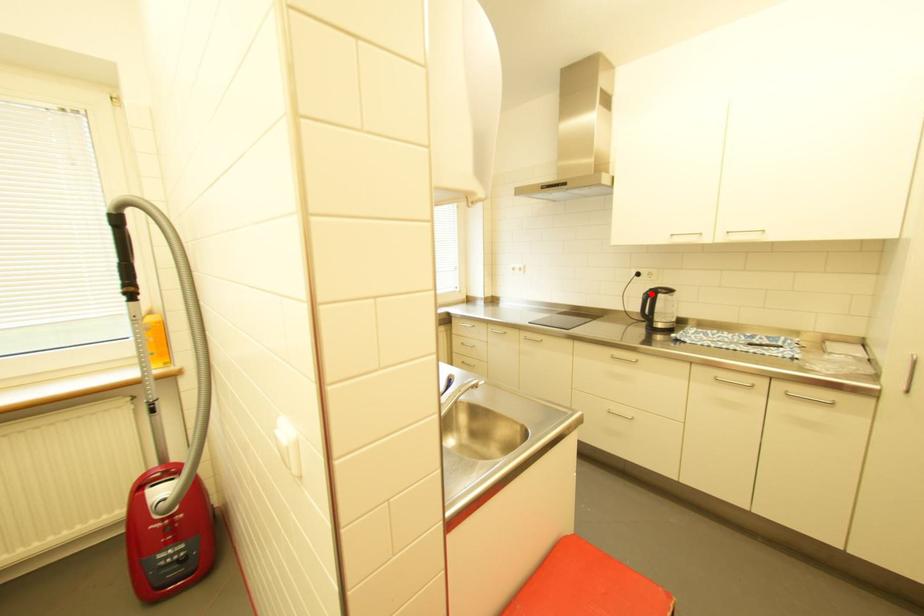
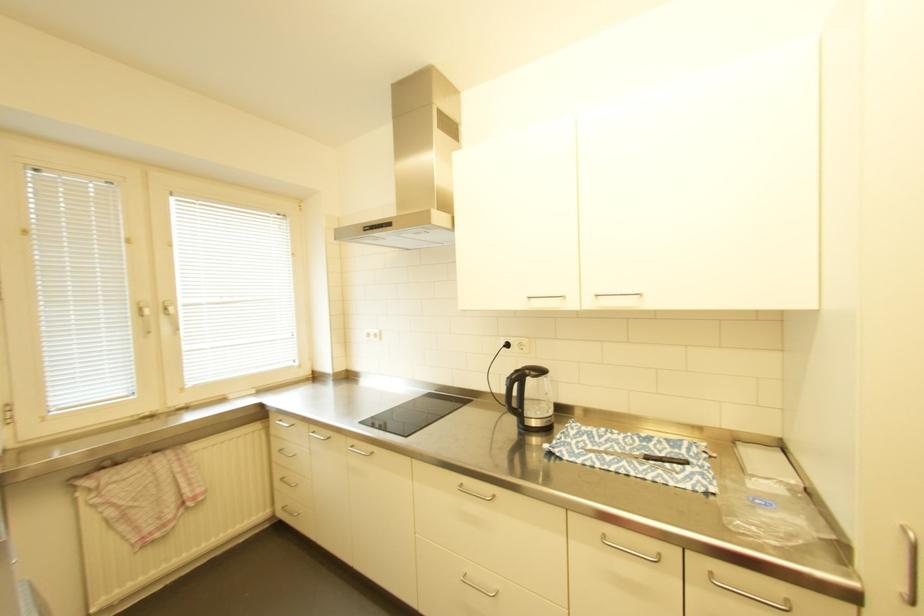
Find the pixel in the second image that matches the highlighted location in the first image.

(516, 379)